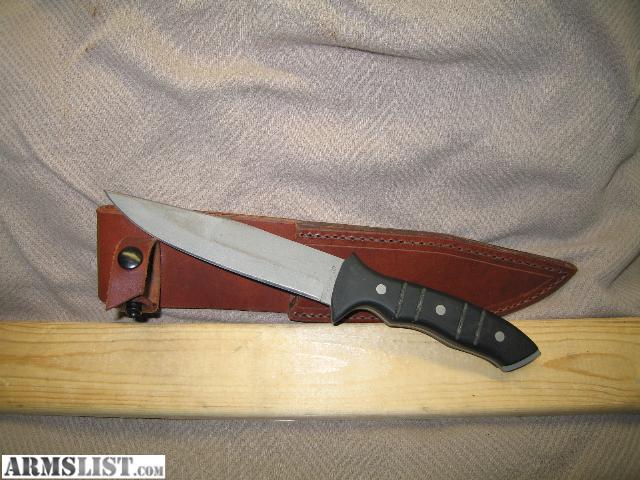
I want to click on light tan wood trim, so click(338, 357).